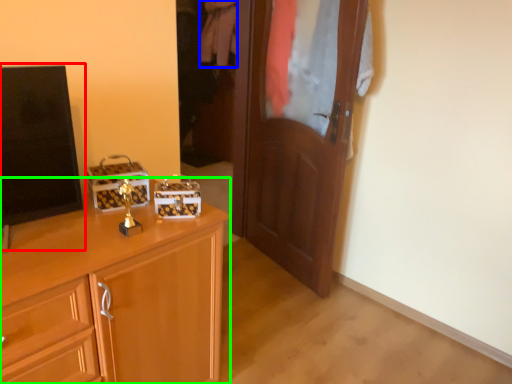
Question: Estimate the real-world distances between objects in this image. Which object is closer to tv show (highlighted by a red box), clothing (highlighted by a blue box) or cabinetry (highlighted by a green box)?

Choices:
 (A) clothing
 (B) cabinetry

Answer: (B)